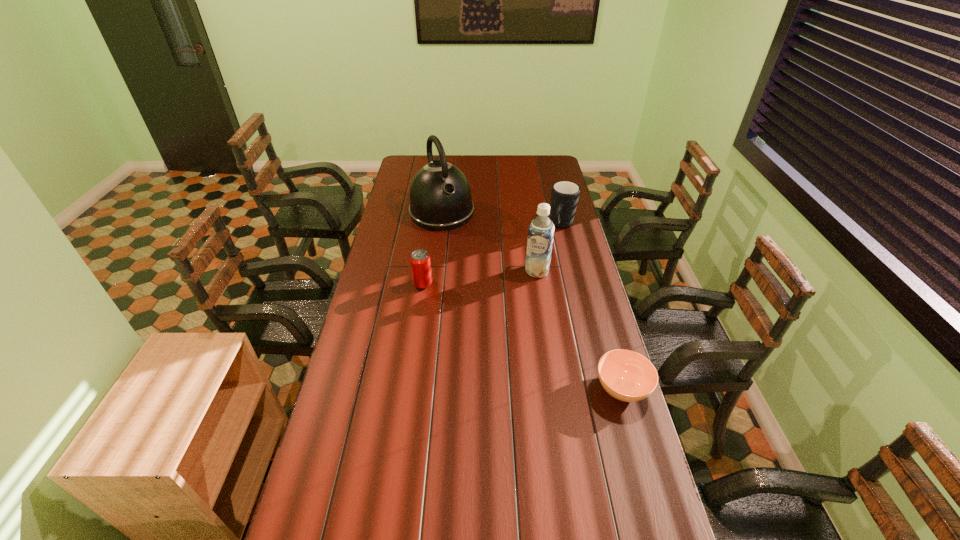
Find the location of a particular element. The image size is (960, 540). mug that is positioned at the right edge is located at coordinates (564, 194).

Where is `vacant position at the far edge of the desktop`? The height and width of the screenshot is (540, 960). vacant position at the far edge of the desktop is located at coordinates (528, 158).

What are the coordinates of `vacant space at the near edge of the desktop` in the screenshot? It's located at (436, 496).

Where is `vacant area at the left edge`? This screenshot has height=540, width=960. vacant area at the left edge is located at coordinates (381, 231).

At what (x,y) coordinates should I click in order to perform the action: click on free space at the right edge of the desktop. Please return your answer as a coordinate pair (x, y). This screenshot has height=540, width=960. Looking at the image, I should click on (587, 308).

The width and height of the screenshot is (960, 540). Identify the location of vacant space at the far left corner. (403, 173).

Image resolution: width=960 pixels, height=540 pixels. In the image, there is a desktop. What are the coordinates of `vacant space at the far right corner` in the screenshot? It's located at (549, 161).

Where is `vacant area that lies between the second shortest object and the mug`? The image size is (960, 540). vacant area that lies between the second shortest object and the mug is located at coordinates (492, 255).

The width and height of the screenshot is (960, 540). I want to click on vacant point located between the soup bowl and the mug, so click(592, 307).

Locate an element on the screen. The image size is (960, 540). free spot between the fourth tallest object and the kettle is located at coordinates (432, 248).